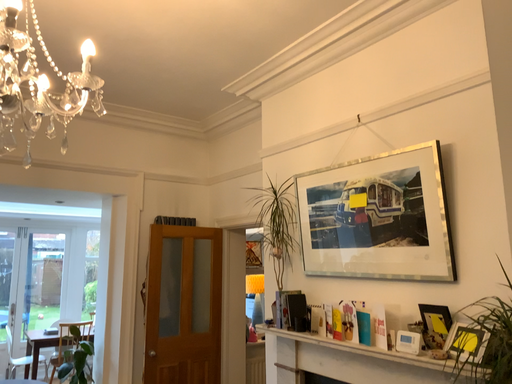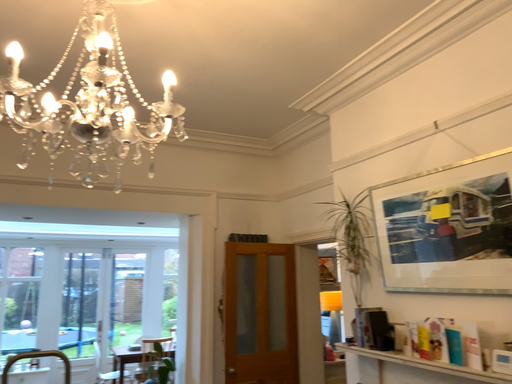
Question: Which way did the camera rotate in the video?

Choices:
 (A) rotated left
 (B) rotated right

Answer: (A)